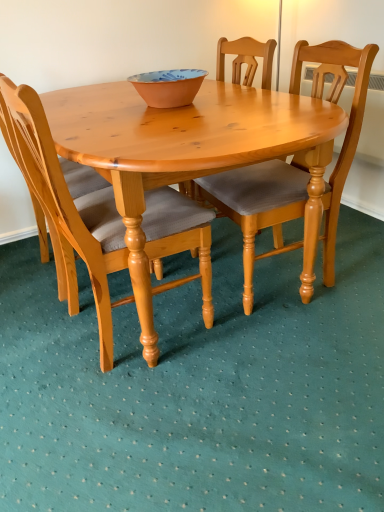
Question: Is light wood/texture chair at center, which is the 2th chair from right to left, positioned behind light brown wood chair at center, positioned as the first chair in right-to-left order?

Choices:
 (A) yes
 (B) no

Answer: (B)

Question: From a real-world perspective, does light wood/texture chair at center, which is the 2th chair from right to left, stand above light brown wood chair at center, positioned as the first chair in right-to-left order?

Choices:
 (A) no
 (B) yes

Answer: (A)

Question: Is light wood/texture chair at center, which is the 1th chair in left-to-right order, facing away from light brown wood chair at center, positioned as the first chair in right-to-left order?

Choices:
 (A) yes
 (B) no

Answer: (B)

Question: Can we say light wood/texture chair at center, which is the 1th chair in left-to-right order, lies outside light brown wood chair at center, the second chair viewed from the left?

Choices:
 (A) no
 (B) yes

Answer: (B)

Question: Does light wood/texture chair at center, which is the 1th chair in left-to-right order, have a lesser width compared to light brown wood chair at center, the second chair viewed from the left?

Choices:
 (A) yes
 (B) no

Answer: (A)

Question: Is light wood/texture chair at center, which is the 1th chair in left-to-right order, aimed at light brown wood chair at center, the second chair viewed from the left?

Choices:
 (A) yes
 (B) no

Answer: (A)

Question: Does terracotta ceramic bowl at center have a smaller size compared to light brown wood chair at center, positioned as the first chair in right-to-left order?

Choices:
 (A) yes
 (B) no

Answer: (A)

Question: Is terracotta ceramic bowl at center shorter than light brown wood chair at center, the second chair viewed from the left?

Choices:
 (A) no
 (B) yes

Answer: (B)

Question: Considering the relative positions of terracotta ceramic bowl at center and light brown wood chair at center, positioned as the first chair in right-to-left order, in the image provided, is terracotta ceramic bowl at center to the left of light brown wood chair at center, positioned as the first chair in right-to-left order, from the viewer's perspective?

Choices:
 (A) no
 (B) yes

Answer: (B)

Question: Is terracotta ceramic bowl at center completely or partially outside of light brown wood chair at center, positioned as the first chair in right-to-left order?

Choices:
 (A) no
 (B) yes

Answer: (B)

Question: From the image's perspective, does terracotta ceramic bowl at center appear lower than light brown wood chair at center, positioned as the first chair in right-to-left order?

Choices:
 (A) no
 (B) yes

Answer: (A)

Question: From a real-world perspective, is terracotta ceramic bowl at center over light brown wood chair at center, positioned as the first chair in right-to-left order?

Choices:
 (A) no
 (B) yes

Answer: (B)

Question: Does terracotta ceramic bowl at center come behind light wood/texture chair at center, which is the 2th chair from right to left?

Choices:
 (A) yes
 (B) no

Answer: (A)